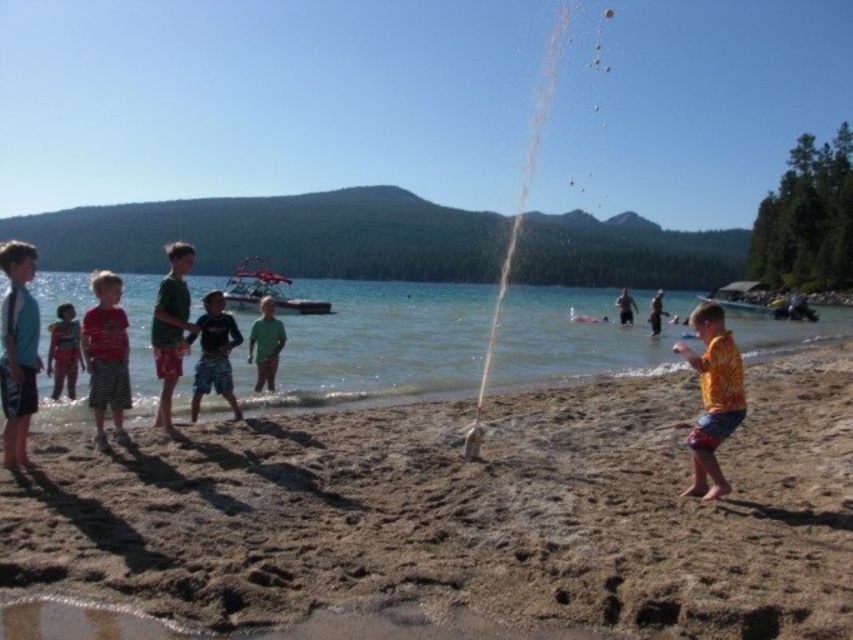
Image resolution: width=853 pixels, height=640 pixels. Describe the element at coordinates (376, 342) in the screenshot. I see `clear water at center` at that location.

Identify the location of clear water at center. The width and height of the screenshot is (853, 640). (376, 342).

What are the coordinates of `clear water at center` in the screenshot? It's located at (376, 342).

Between point (726, 337) and point (114, 362), which one is positioned behind?

The point (114, 362) is more distant.

Does yellow tie-dye shirt at center appear on the left side of matte red shirt at left?

No, yellow tie-dye shirt at center is not to the left of matte red shirt at left.

Find the location of a particular element. yellow tie-dye shirt at center is located at coordinates (712, 397).

Does point (177, 349) come in front of point (213, 355)?

Yes, point (177, 349) is closer to viewer.

Between point (169, 264) and point (241, 417), which one is positioned in front?

Positioned in front is point (241, 417).

This screenshot has height=640, width=853. Find the location of `green cotton shorts at center`. green cotton shorts at center is located at coordinates (170, 328).